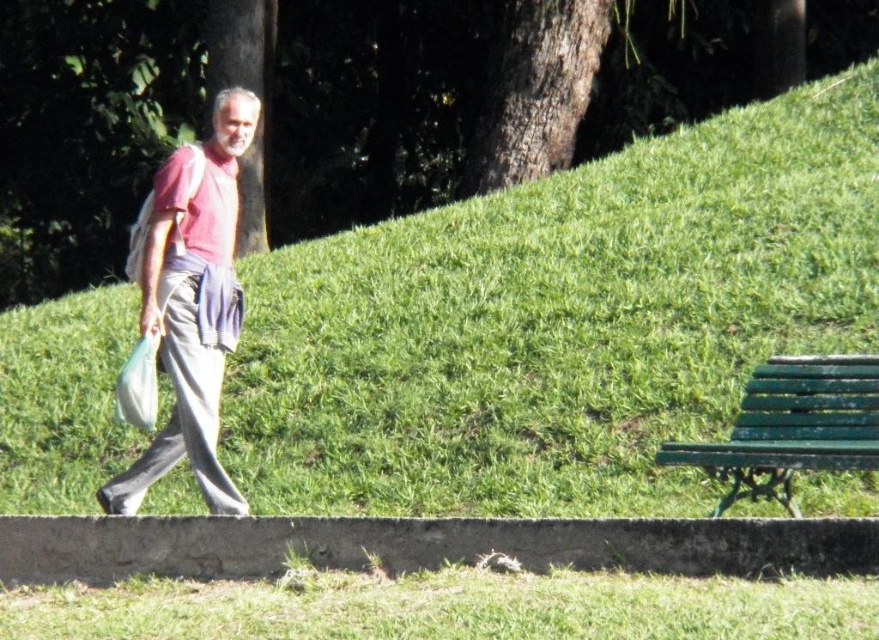
You are a hiker planning to walk from the green grassy at lower center to the green grassy hillside at center. Which direction should you head to reach the hillside?

The green grassy at lower center is behind the green grassy hillside at center, so to reach the hillside, you should head forward from the green grassy at lower center.

You are a drone operator trying to capture a photo of the green grassy at lower center and the matte red shirt at left. Which object should you focus on first if you want to ensure both are in focus without adjusting the camera settings?

The green grassy at lower center is in front of the matte red shirt at left, so you should focus on the matte red shirt at left first. This way, since it is farther away, the depth of field may include both objects in focus.